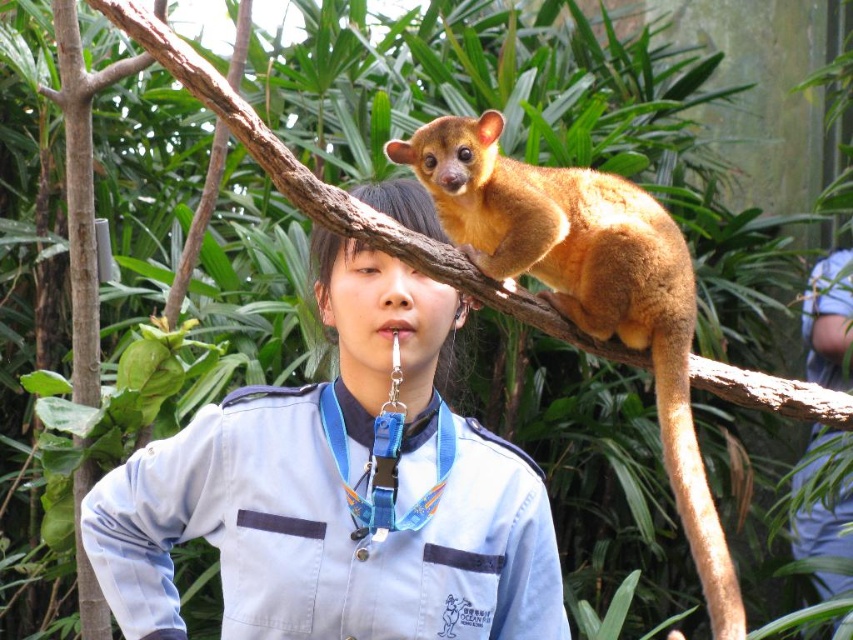
Question: Where is golden-brown fur at upper right located in relation to blue lanyard at center in the image?

Choices:
 (A) above
 (B) below

Answer: (A)

Question: Does matte brown fur at upper center appear on the left side of golden-brown fur at upper right?

Choices:
 (A) no
 (B) yes

Answer: (B)

Question: Among these points, which one is farthest from the camera?

Choices:
 (A) (688, 502)
 (B) (109, 518)

Answer: (B)

Question: Among these objects, which one is farthest from the camera?

Choices:
 (A) golden-brown fur at upper right
 (B) brown furry tail at right

Answer: (A)

Question: Which of these objects is positioned closest to the golden-brown fur at upper right?

Choices:
 (A) matte brown fur at upper center
 (B) blue lanyard at center
 (C) brown furry tail at right

Answer: (C)

Question: Does golden-brown fur at upper right have a smaller size compared to brown furry tail at right?

Choices:
 (A) no
 (B) yes

Answer: (A)